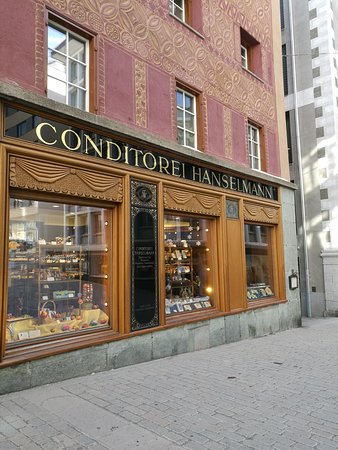
Where is `wall bottom`? wall bottom is located at coordinates (219, 334).